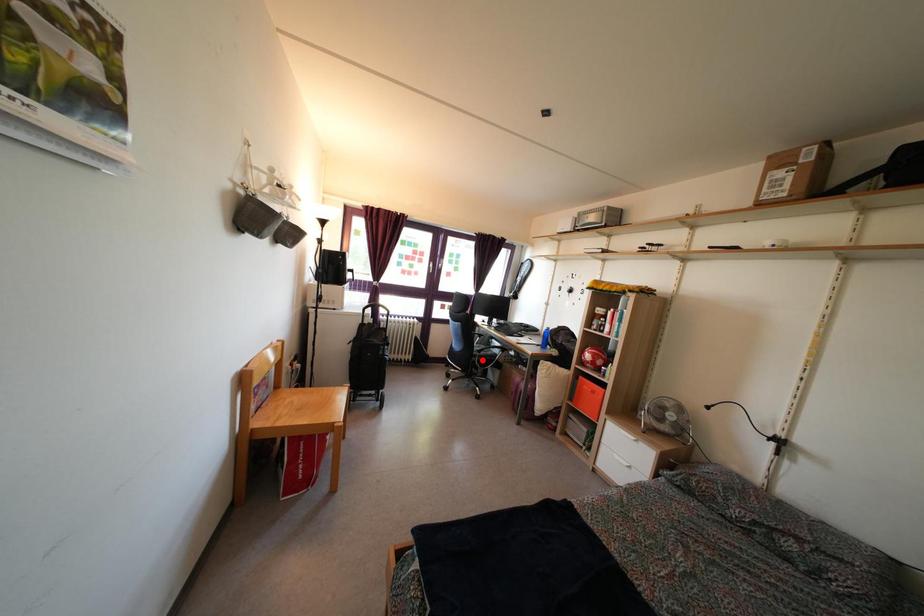
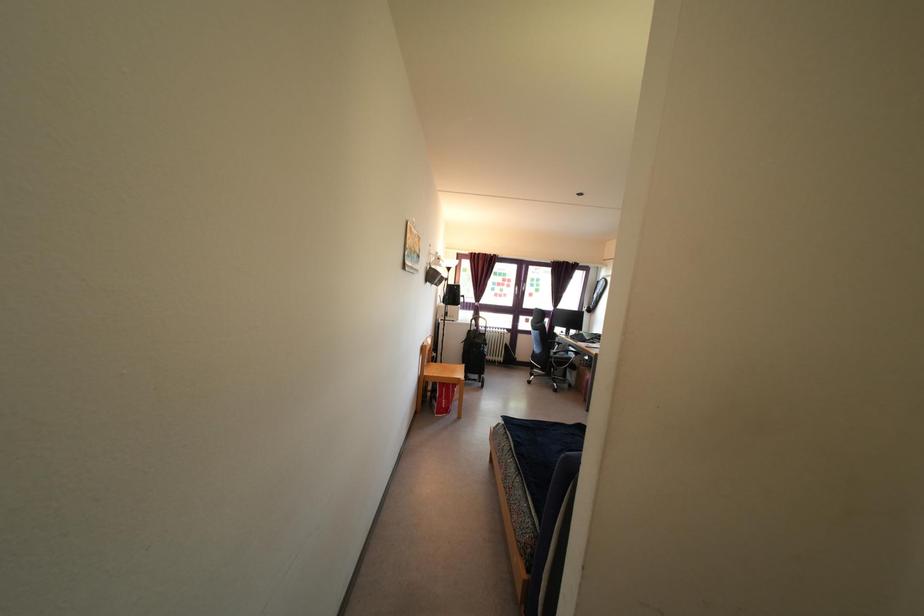
Find the pixel in the second image that matches the highlighted location in the first image.

(557, 362)